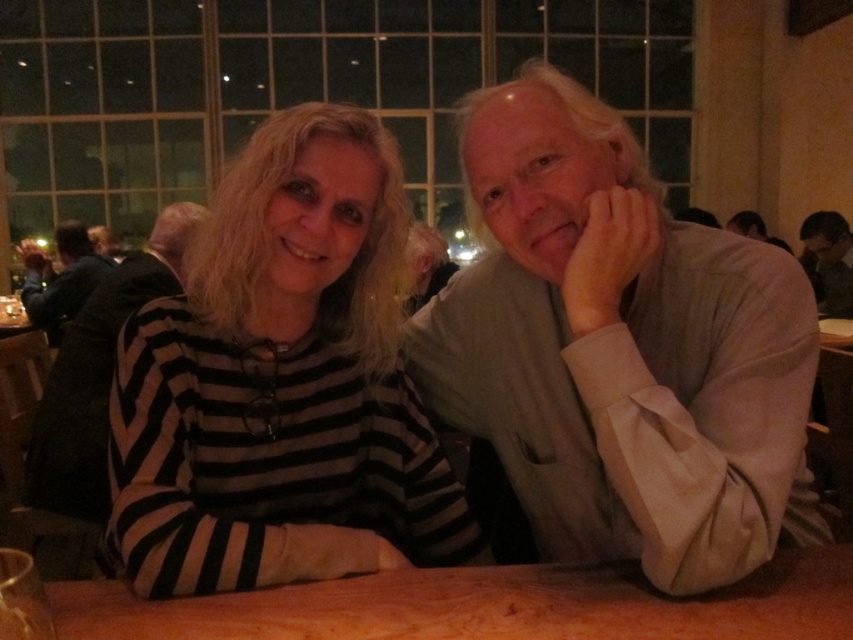
Which is above, black striped sweater at center or smooth gray shirt at upper right?

smooth gray shirt at upper right is above.

Does point (354, 547) lie in front of point (849, 316)?

Yes, point (354, 547) is closer to viewer.

The image size is (853, 640). I want to click on black striped sweater at center, so click(281, 384).

Where is `light beige shirt at center`? light beige shirt at center is located at coordinates (619, 349).

Is light beige shirt at center thinner than smooth gray shirt at upper right?

In fact, light beige shirt at center might be wider than smooth gray shirt at upper right.

What are the coordinates of `light beige shirt at center` in the screenshot? It's located at point(619,349).

Does black striped sweater at center have a larger size compared to dark gray sweater at left?

Incorrect, black striped sweater at center is not larger than dark gray sweater at left.

Is point (227, 182) positioned after point (28, 256)?

That is False.

Does point (206, 390) lie behind point (39, 307)?

That is False.

This screenshot has width=853, height=640. Identify the location of black striped sweater at center. (281, 384).